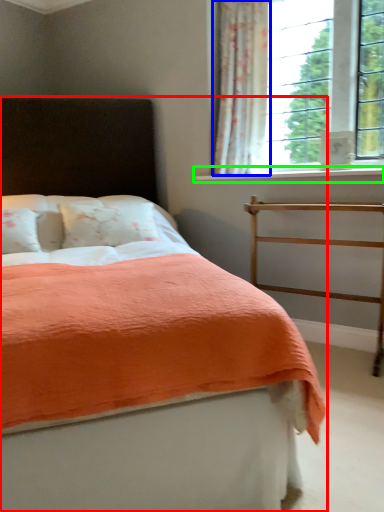
Question: Estimate the real-world distances between objects in this image. Which object is farther from bed (highlighted by a red box), curtain (highlighted by a blue box) or window sill (highlighted by a green box)?

Choices:
 (A) curtain
 (B) window sill

Answer: (A)